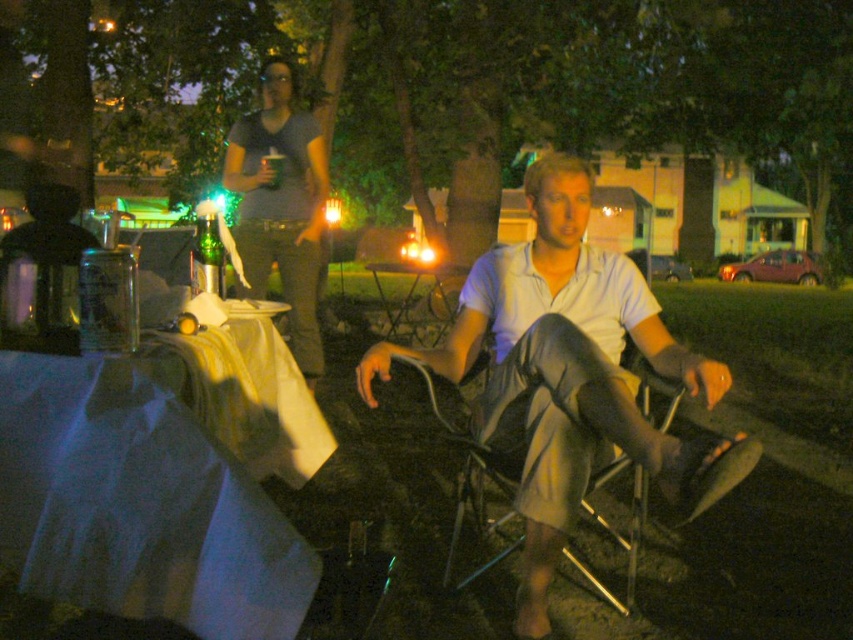
Question: Does light blue cotton shirt at center have a greater width compared to metallic silver chair at center?

Choices:
 (A) yes
 (B) no

Answer: (A)

Question: Among these objects, which one is nearest to the camera?

Choices:
 (A) metallic silver chair at center
 (B) light blue cotton shirt at center

Answer: (B)

Question: Which object is closer to the camera taking this photo?

Choices:
 (A) metallic silver chair at center
 (B) light blue cotton shirt at center

Answer: (B)

Question: Which point appears farthest from the camera in this image?

Choices:
 (A) (503, 480)
 (B) (695, 394)

Answer: (A)

Question: Is light blue cotton shirt at center wider than metallic silver chair at center?

Choices:
 (A) no
 (B) yes

Answer: (B)

Question: Is light blue cotton shirt at center to the left of metallic silver chair at center from the viewer's perspective?

Choices:
 (A) no
 (B) yes

Answer: (B)